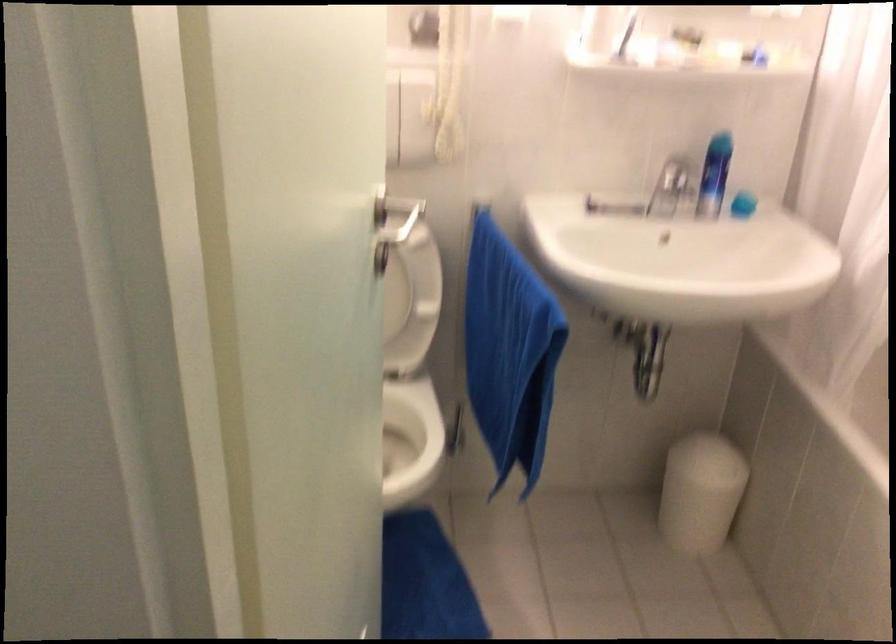
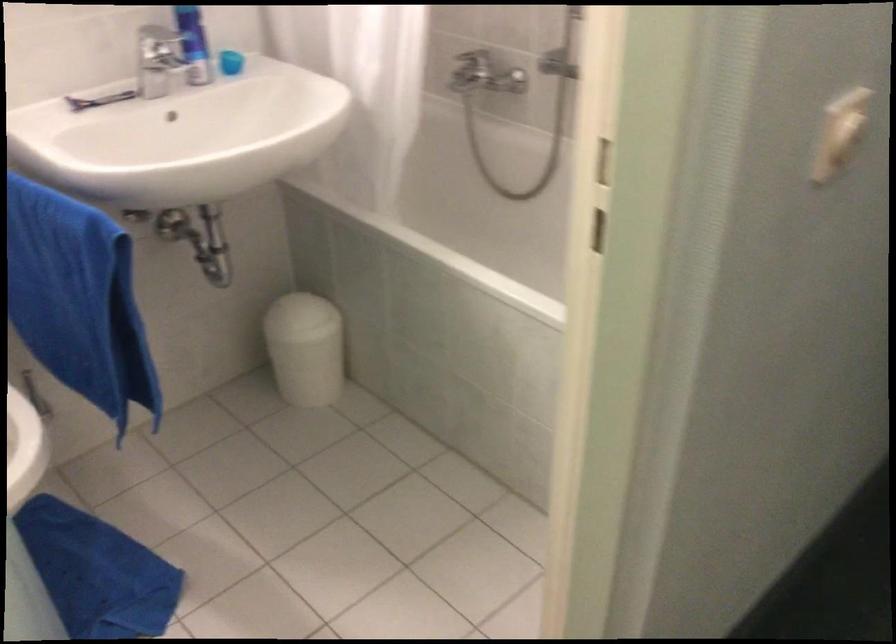
In the second image, find the point that corresponds to (x=711, y=178) in the first image.

(194, 44)